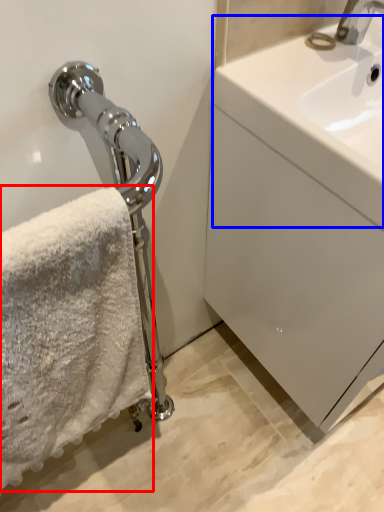
Question: Among these objects, which one is nearest to the camera, towel (highlighted by a red box) or counter top (highlighted by a blue box)?

Choices:
 (A) towel
 (B) counter top

Answer: (A)